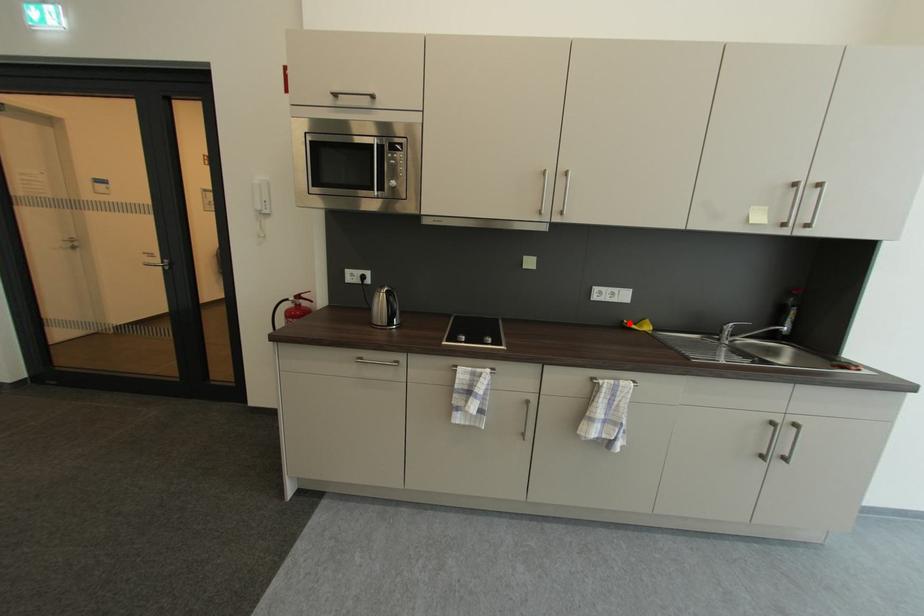
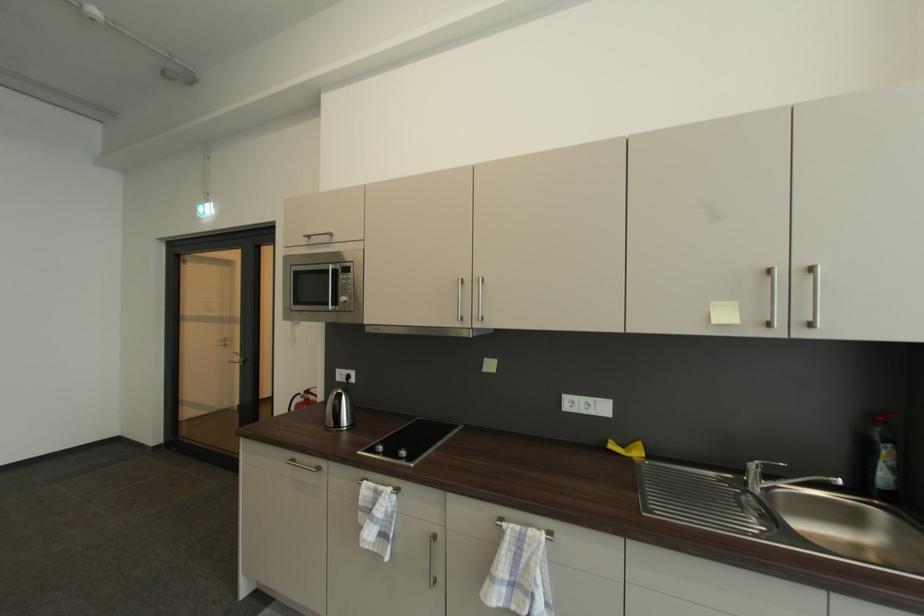
Locate, in the second image, the point that corresponds to the highlighted location in the first image.

(613, 443)